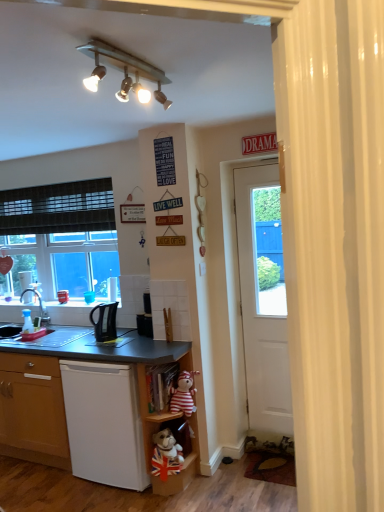
Find the location of a particular element. free spot to the right of black plastic kettle at lower left is located at coordinates (132, 337).